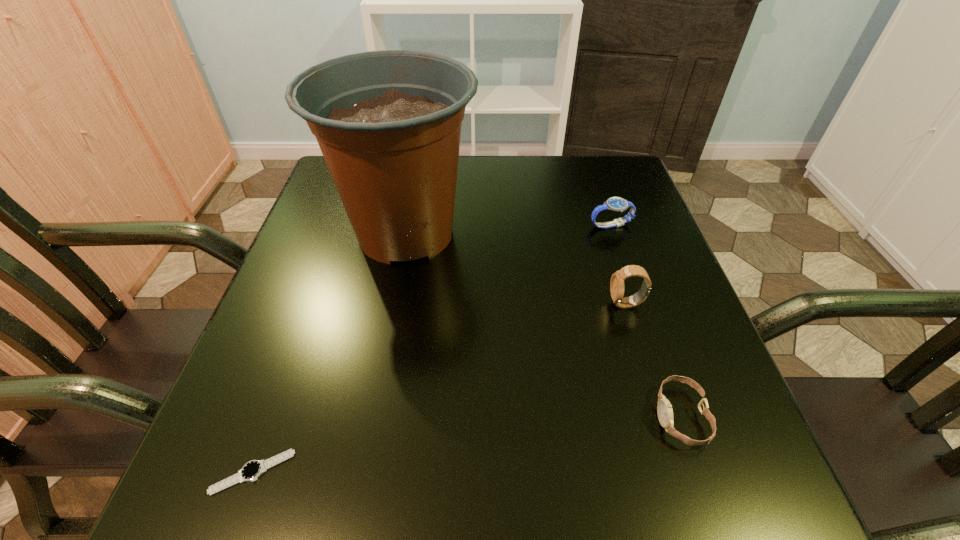
Find the location of a particular element. The height and width of the screenshot is (540, 960). vacant region located on the face of the fourth shortest object is located at coordinates (476, 304).

Locate an element on the screen. The image size is (960, 540). vacant space positioned 0.080m on the face of the fourth shortest object is located at coordinates point(568,304).

You are a GUI agent. You are given a task and a screenshot of the screen. Output one action in this format:
    pyautogui.click(x=<x>, y=<y>)
    Task: Click on the vacant space situated on the left of the farthest watch
    The height and width of the screenshot is (540, 960).
    Given the screenshot: What is the action you would take?
    pyautogui.click(x=465, y=226)

You are a GUI agent. You are given a task and a screenshot of the screen. Output one action in this format:
    pyautogui.click(x=<x>, y=<y>)
    Task: Click on the free spot located on the face of the fourth tallest object
    The height and width of the screenshot is (540, 960).
    Given the screenshot: What is the action you would take?
    click(498, 416)

You are a GUI agent. You are given a task and a screenshot of the screen. Output one action in this format:
    pyautogui.click(x=<x>, y=<y>)
    Task: Click on the vacant region located 0.360m on the face of the fourth tallest object
    
    Given the screenshot: What is the action you would take?
    pyautogui.click(x=428, y=416)

Identify the location of vacant area located on the face of the fourth tallest object. (453, 416).

You are a GUI agent. You are given a task and a screenshot of the screen. Output one action in this format:
    pyautogui.click(x=<x>, y=<y>)
    Task: Click on the vacant space located 0.080m on the back of the shortest watch
    Image resolution: width=960 pixels, height=540 pixels.
    Given the screenshot: What is the action you would take?
    pyautogui.click(x=278, y=401)

The width and height of the screenshot is (960, 540). What are the coordinates of `object situated at the far edge` in the screenshot? It's located at (388, 123).

The image size is (960, 540). Identify the location of object at the near edge. (251, 471).

At what (x,y) coordinates should I click in order to perform the action: click on flowerpot that is at the left edge. Please return your answer as a coordinate pair (x, y). Looking at the image, I should click on (388, 123).